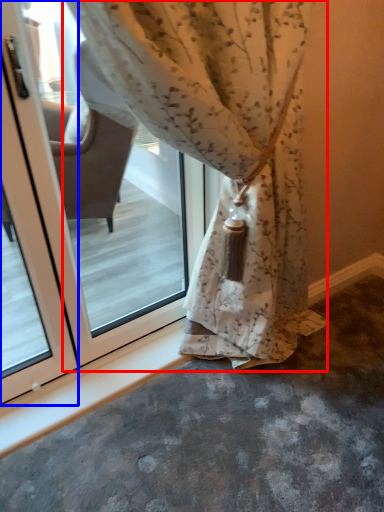
Question: Which point is closer to the camera, curtain (highlighted by a red box) or screen door (highlighted by a blue box)?

Choices:
 (A) curtain
 (B) screen door

Answer: (A)